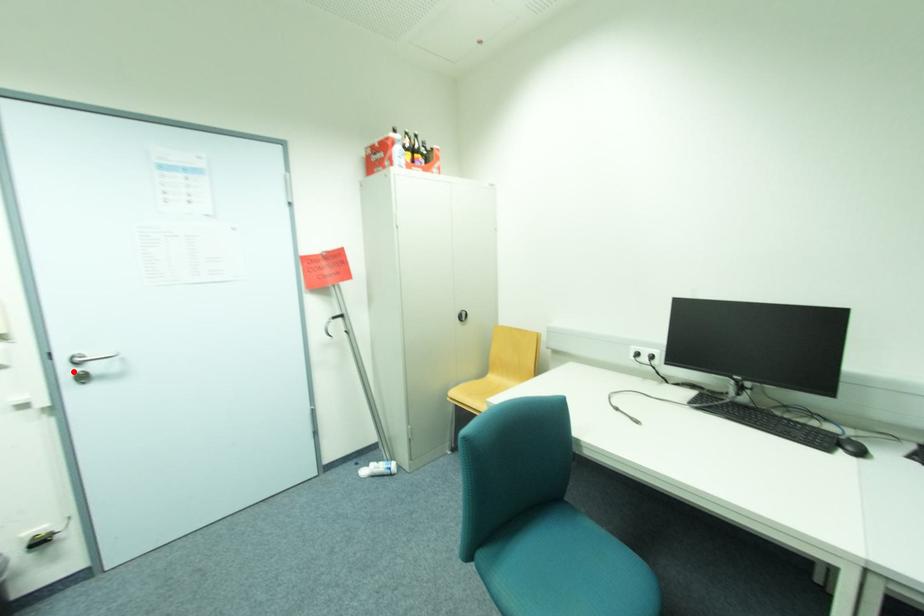
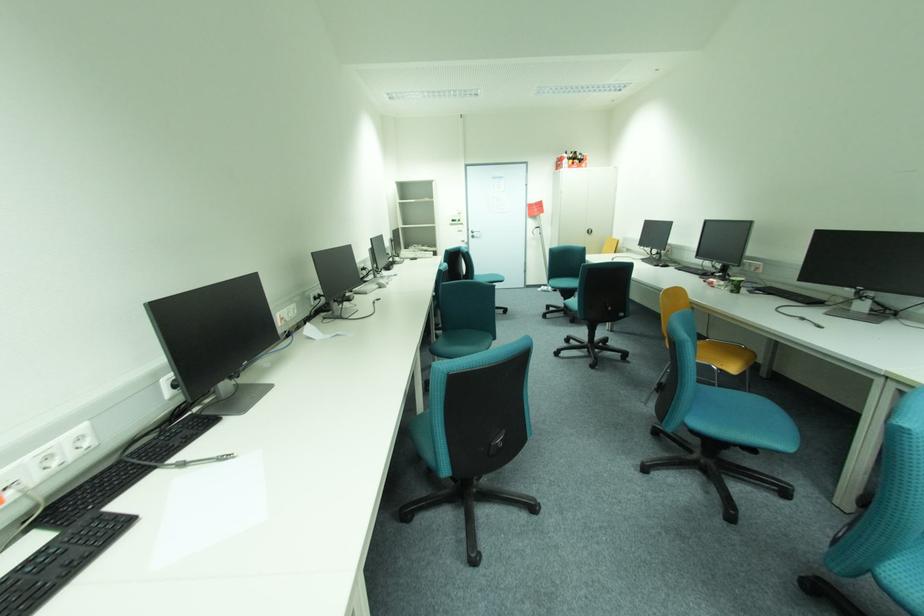
Question: I am providing you with two images of the same scene from different viewpoints. A red point is marked on the first image. Is the red point's position out of view in image 2?

Choices:
 (A) Yes
 (B) No

Answer: (B)